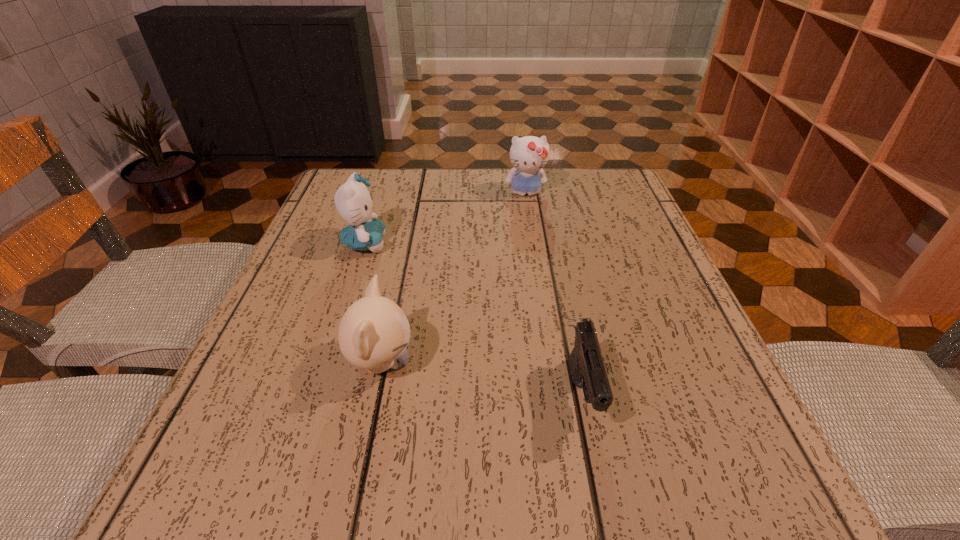
Find the location of a particular element. Image resolution: width=960 pixels, height=540 pixels. object located at the left edge is located at coordinates (354, 203).

At what (x,y) coordinates should I click in order to perform the action: click on blank area at the far edge. Please return your answer as a coordinate pair (x, y). The image size is (960, 540). Looking at the image, I should click on (468, 187).

Identify the location of blank space at the left edge of the desktop. This screenshot has height=540, width=960. (280, 332).

The height and width of the screenshot is (540, 960). Identify the location of vacant space at the right edge of the desktop. (601, 280).

The image size is (960, 540). In order to click on vacant space at the far left corner of the desktop in this screenshot , I will do `click(378, 171)`.

I want to click on free point at the far right corner, so click(607, 190).

At what (x,y) coordinates should I click in order to perform the action: click on free space between the nearest kitten and the shortest object. Please return your answer as a coordinate pair (x, y). Looking at the image, I should click on (482, 380).

You are a GUI agent. You are given a task and a screenshot of the screen. Output one action in this format:
    pyautogui.click(x=<x>, y=<y>)
    Task: Click on the vacant space in between the nearest kitten and the shortest object
    The height and width of the screenshot is (540, 960).
    Given the screenshot: What is the action you would take?
    pyautogui.click(x=482, y=380)

This screenshot has height=540, width=960. Find the location of `free area in between the nearest kitten and the farthest object`. free area in between the nearest kitten and the farthest object is located at coordinates (453, 278).

The image size is (960, 540). I want to click on blank region between the shortest object and the second farthest kitten, so click(x=474, y=320).